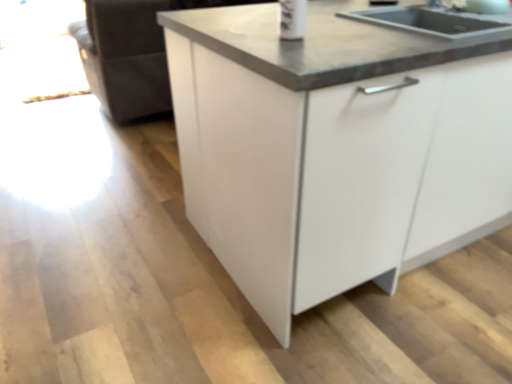
Question: Is black granite sink at upper right facing away from white glossy cabinet at center?

Choices:
 (A) yes
 (B) no

Answer: (A)

Question: Is black granite sink at upper right thinner than white glossy cabinet at center?

Choices:
 (A) no
 (B) yes

Answer: (B)

Question: Considering the relative positions of black granite sink at upper right and white glossy cabinet at center in the image provided, is black granite sink at upper right to the right of white glossy cabinet at center from the viewer's perspective?

Choices:
 (A) no
 (B) yes

Answer: (A)

Question: From the image's perspective, is black granite sink at upper right located above white glossy cabinet at center?

Choices:
 (A) no
 (B) yes

Answer: (B)

Question: From the image's perspective, is black granite sink at upper right located beneath white glossy cabinet at center?

Choices:
 (A) no
 (B) yes

Answer: (A)

Question: Is black granite sink at upper right wider than white glossy cabinet at center?

Choices:
 (A) yes
 (B) no

Answer: (B)

Question: Is white glossy cabinet at center aimed at black granite sink at upper right?

Choices:
 (A) no
 (B) yes

Answer: (B)

Question: Can you confirm if white glossy cabinet at center is shorter than black granite sink at upper right?

Choices:
 (A) no
 (B) yes

Answer: (A)

Question: Is black granite sink at upper right surrounded by white glossy cabinet at center?

Choices:
 (A) yes
 (B) no

Answer: (A)

Question: Considering the relative positions of white glossy cabinet at center and black granite sink at upper right in the image provided, is white glossy cabinet at center behind black granite sink at upper right?

Choices:
 (A) no
 (B) yes

Answer: (A)

Question: Can you confirm if white glossy cabinet at center is thinner than black granite sink at upper right?

Choices:
 (A) yes
 (B) no

Answer: (B)

Question: Is white glossy cabinet at center bigger than black granite sink at upper right?

Choices:
 (A) yes
 (B) no

Answer: (A)

Question: From the image's perspective, relative to black granite sink at upper right, is white glossy cabinet at center above or below?

Choices:
 (A) above
 (B) below

Answer: (B)